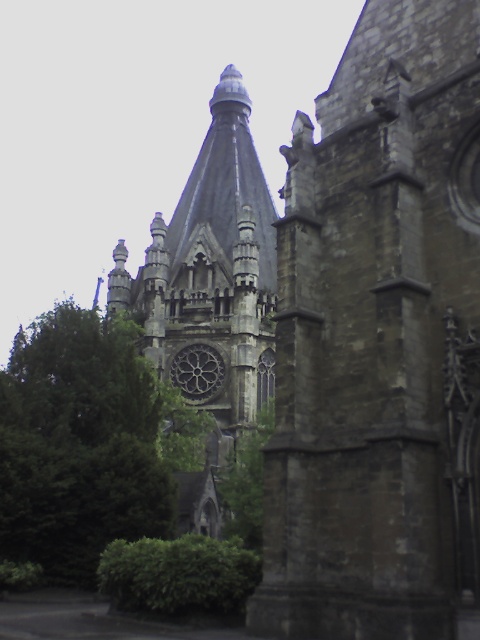
Between dark stone tower at center and green leafy tree at left, which one appears on the right side from the viewer's perspective?

dark stone tower at center

Is dark stone tower at center shorter than green leafy tree at left?

In fact, dark stone tower at center may be taller than green leafy tree at left.

Identify the location of dark stone tower at center. This screenshot has height=640, width=480. (380, 342).